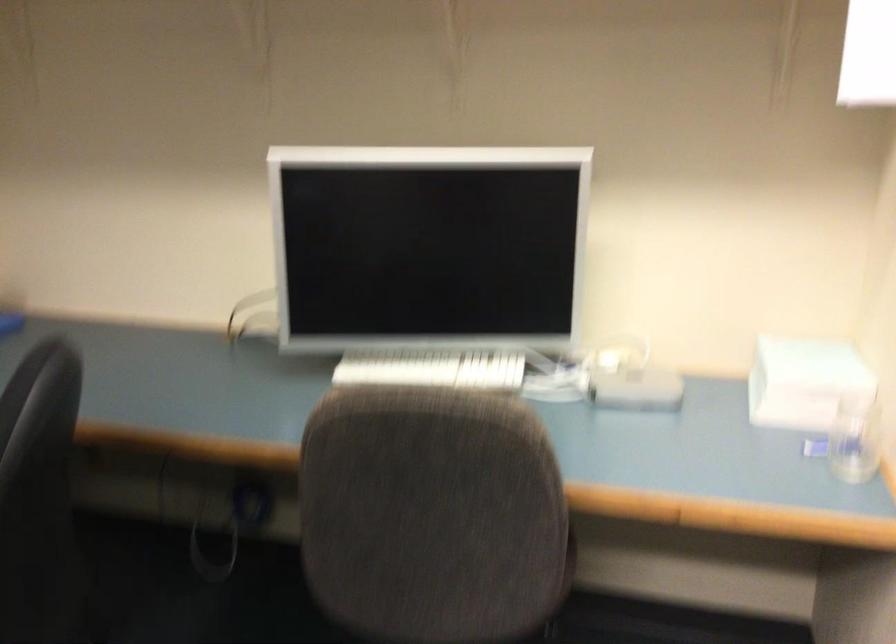
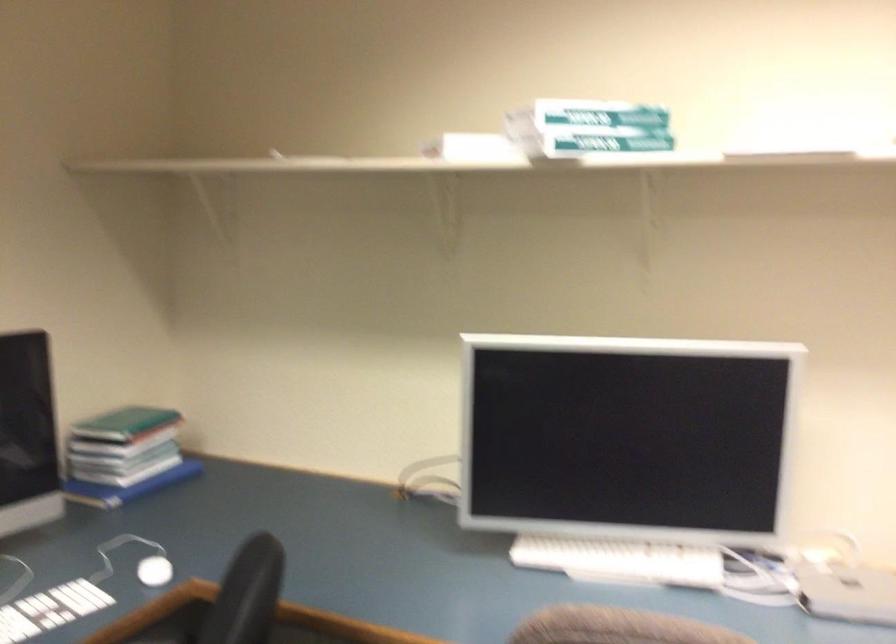
Question: The camera is either moving clockwise (left) or counter-clockwise (right) around the object. The first image is from the beginning of the video and the second image is from the end. Is the camera moving left or right when shooting the video?

Choices:
 (A) Left
 (B) Right

Answer: (B)